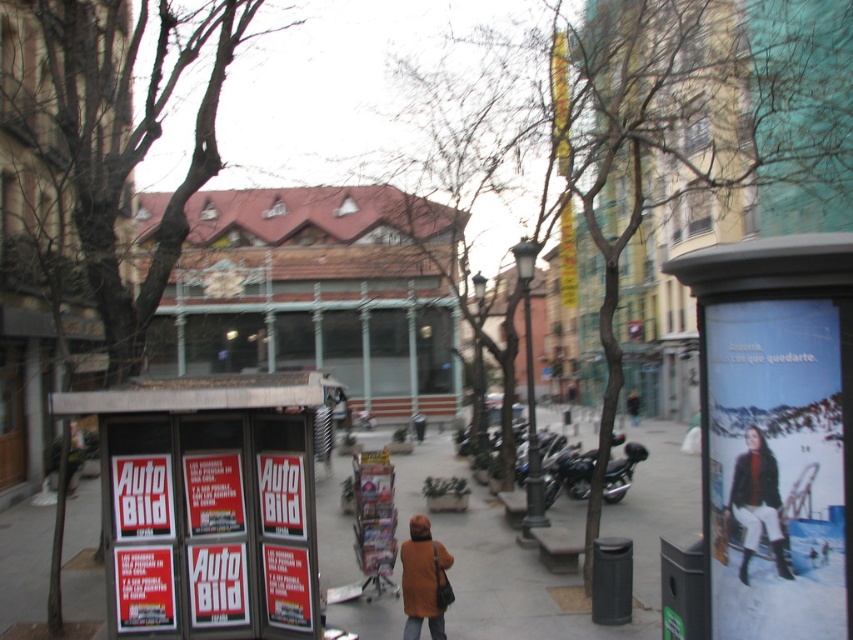
Can you confirm if smooth concrete pavement at center is bigger than shiny black motorcycle at center?

Yes, smooth concrete pavement at center is bigger than shiny black motorcycle at center.

How far apart are smooth concrete pavement at center and shiny black motorcycle at center?

They are 4.78 meters apart.

Does point (503, 564) come behind point (573, 464)?

No, it is not.

The image size is (853, 640). Identify the location of smooth concrete pavement at center. (537, 552).

From the picture: Does smooth concrete pavement at center have a lesser width compared to orange woolen coat at lower center?

In fact, smooth concrete pavement at center might be wider than orange woolen coat at lower center.

Does smooth concrete pavement at center have a greater height compared to orange woolen coat at lower center?

No, smooth concrete pavement at center is not taller than orange woolen coat at lower center.

This screenshot has height=640, width=853. I want to click on smooth concrete pavement at center, so click(537, 552).

Who is more forward, (x=138, y=516) or (x=740, y=579)?

Point (x=740, y=579)

Between red glossy magazine stand at center and leather jacket at lower right, which one has less height?

Standing shorter between the two is leather jacket at lower right.

Is point (244, 483) behind point (744, 504)?

Yes.

Find the location of `red glossy magazine stand at center`. red glossy magazine stand at center is located at coordinates (207, 504).